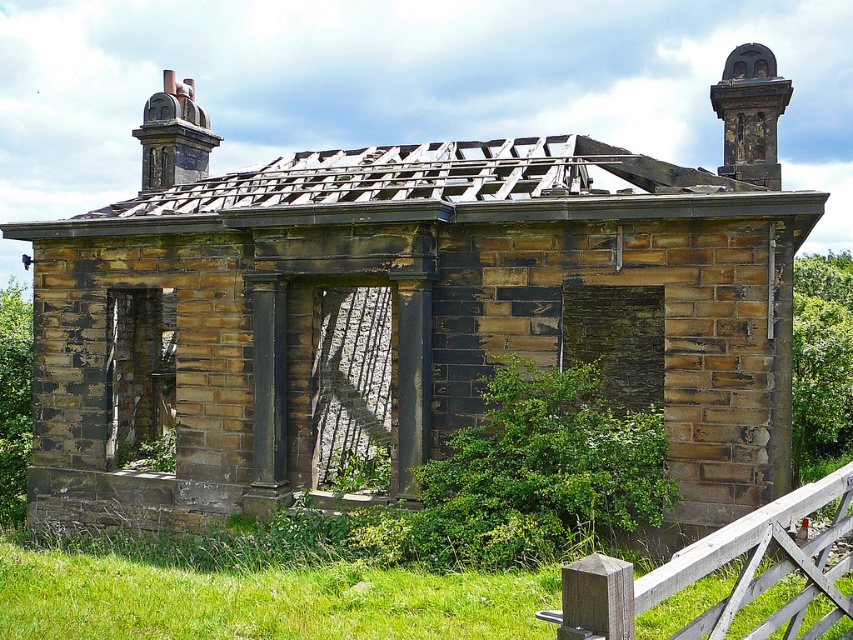
You are standing in front of an old stone building and notice two points marked on its structure. The first point is at coordinates point [792,339] and the second is at point [729,58]. Which point is nearer to your current position?

Point [792,339] is closer to the camera than point [729,58], so the first point is nearer to your current position.

You are standing in front of an old stone building and notice a green leafy bush at left and a dark gray stone chimney at upper left. Which object is nearer to you?

The green leafy bush at left is closer to the viewer than the dark gray stone chimney at upper left.

You are standing outside the old stone building and want to know which object is taller between the green leafy bush at left and the dark gray stone chimney at upper left. Can you determine this?

The green leafy bush at left has a lesser height compared to the dark gray stone chimney at upper left, so the dark gray stone chimney at upper left is taller.